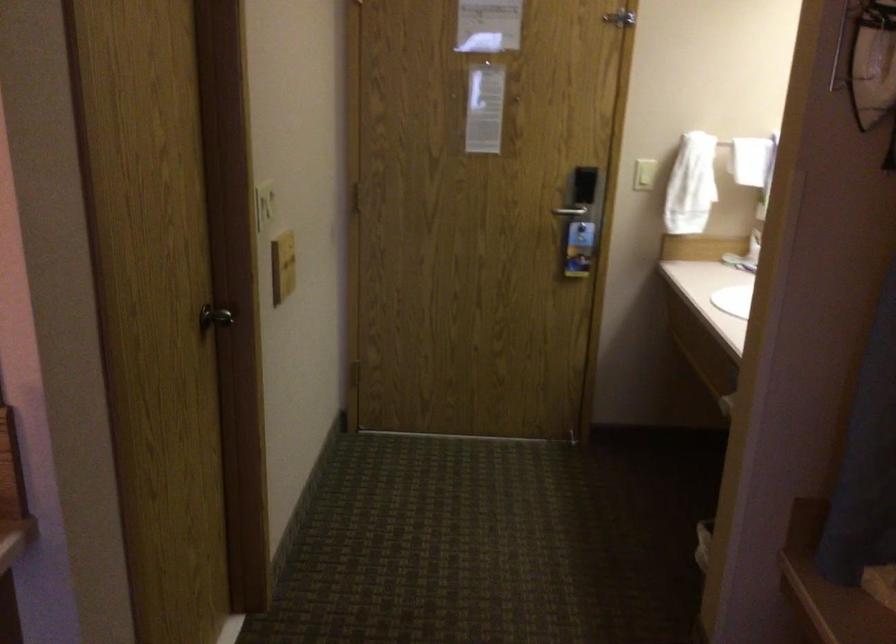
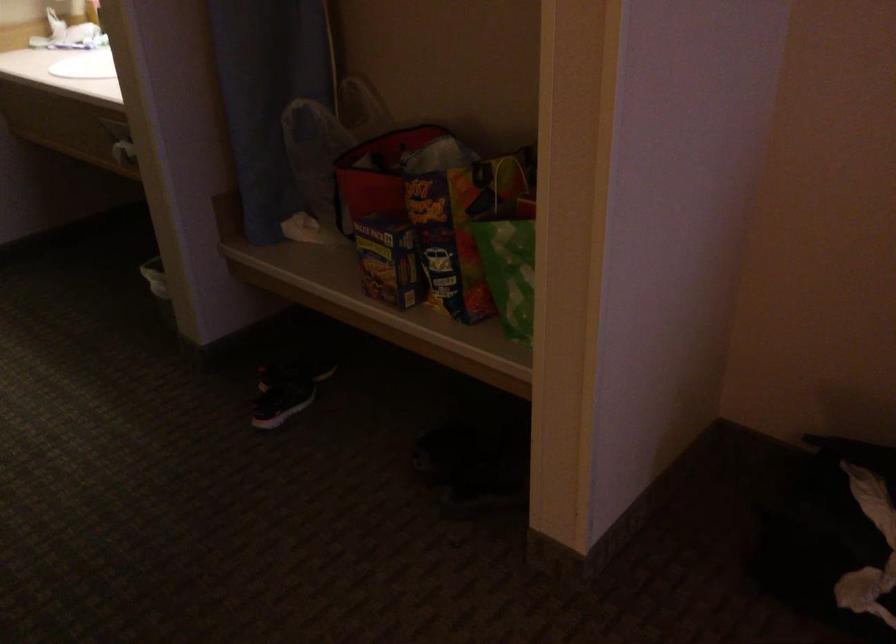
The first image is from the beginning of the video and the second image is from the end. How did the camera likely rotate when shooting the video?

The camera's rotation is toward right-down.